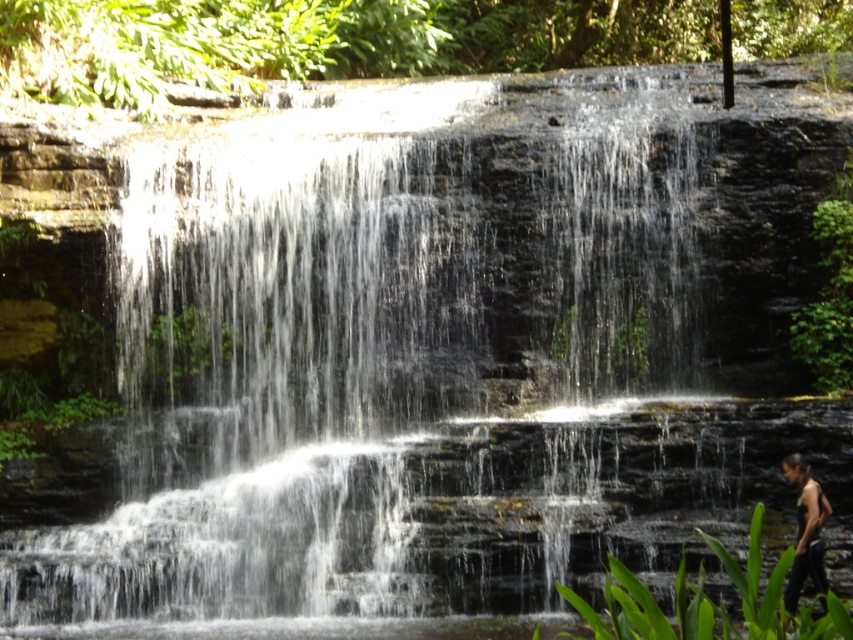
You are standing at the edge of the waterfall and want to take a photo of both the green leafy plant at lower right and the black tank top at lower right. Which object should you focus on first to ensure both are in the frame?

You should focus on the green leafy plant at lower right first because it is closer to the viewer than the black tank top at lower right, so adjusting the focus from near to far will help capture both in the frame.

You are a photographer trying to capture the waterfall and the person in the scene. Since the black tank top at lower right and the green leafy vegetation at upper center are both in your viewfinder, which object should you focus on to ensure the person is clearly visible?

To ensure the person wearing the black tank top at lower right is clearly visible, you should focus on the black tank top at lower right because it is behind the green leafy vegetation at upper center, meaning the vegetation might obscure the person if not properly focused.